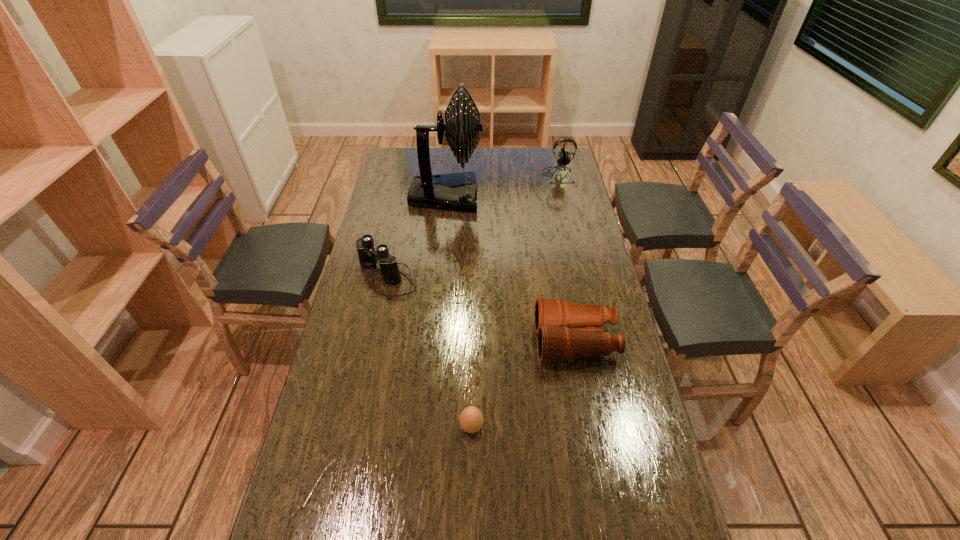
In order to click on free space between the earphone and the fan in this screenshot , I will do `click(502, 185)`.

The width and height of the screenshot is (960, 540). Identify the location of vacant area that lies between the farther binoculars and the nearer binoculars. (481, 309).

Where is `vacant space that is in between the tallest object and the nearer binoculars`? The height and width of the screenshot is (540, 960). vacant space that is in between the tallest object and the nearer binoculars is located at coordinates (511, 268).

Find the location of `free space between the right binoculars and the shortest object`. free space between the right binoculars and the shortest object is located at coordinates (523, 384).

Locate an element on the screen. Image resolution: width=960 pixels, height=540 pixels. free spot between the earphone and the tallest object is located at coordinates (502, 185).

Identify the location of object that ranks as the third closest to the earphone. This screenshot has height=540, width=960. click(x=560, y=325).

The height and width of the screenshot is (540, 960). Find the location of `the second closest object to the fan`. the second closest object to the fan is located at coordinates (563, 157).

Identify the location of free space that satisfies the following two spatial constraints: 1. in front of the fan to blow air; 2. on the left side of the shortest object. The height and width of the screenshot is (540, 960). (424, 427).